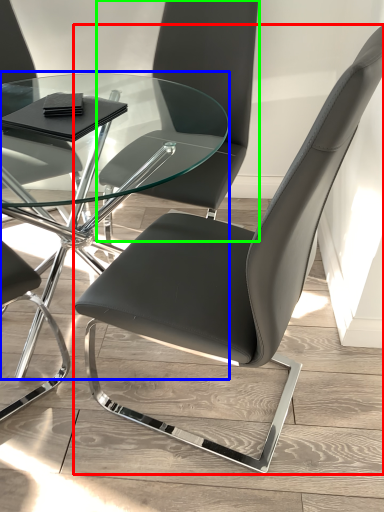
Question: Considering the real-world distances, which object is closest to chair (highlighted by a red box)? table (highlighted by a blue box) or chair (highlighted by a green box).

Choices:
 (A) table
 (B) chair

Answer: (B)